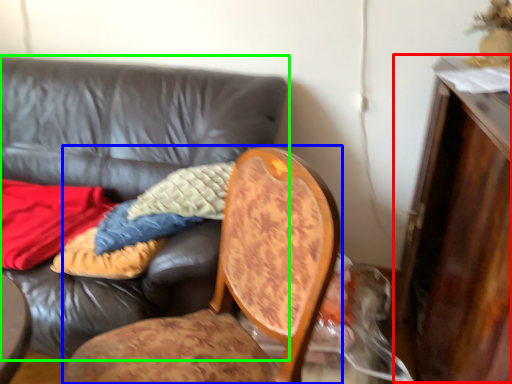
Question: Based on their relative distances, which object is farther from dresser (highlighted by a red box)? Choose from chair (highlighted by a blue box) and studio couch (highlighted by a green box).

Choices:
 (A) chair
 (B) studio couch

Answer: (B)